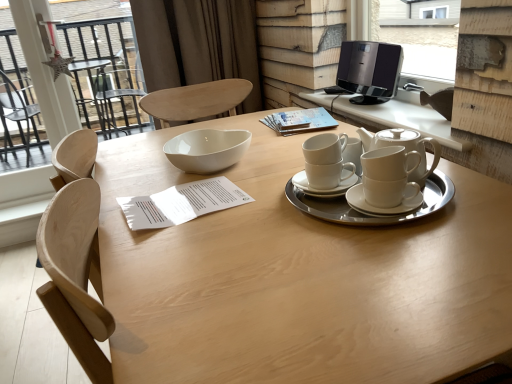
You are a GUI agent. You are given a task and a screenshot of the screen. Output one action in this format:
    pyautogui.click(x=<x>, y=<y>)
    Task: Click on the free point in front of white ceramic cups at center
    This screenshot has width=512, height=384.
    Given the screenshot: What is the action you would take?
    pyautogui.click(x=380, y=264)